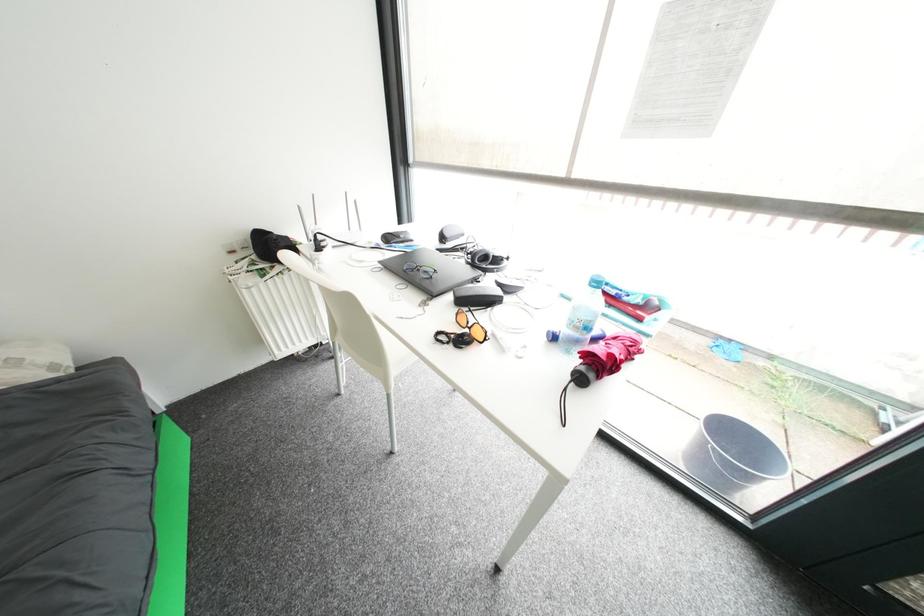
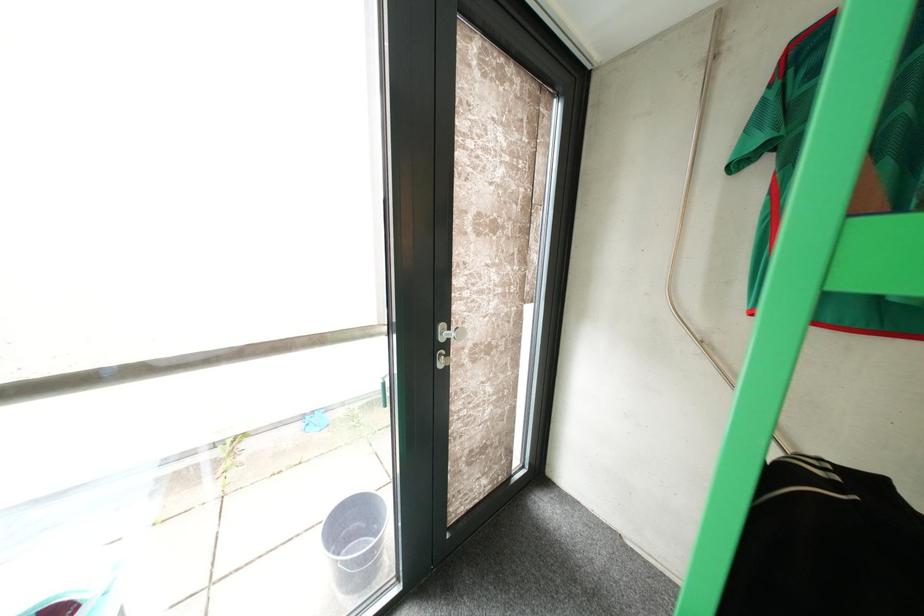
Question: How did the camera likely rotate?

Choices:
 (A) Left
 (B) Right
 (C) Up
 (D) Down

Answer: (B)